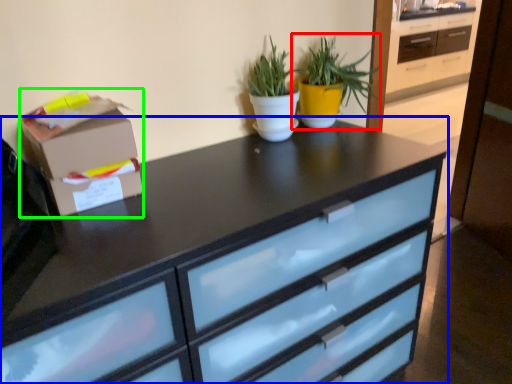
Question: Which object is the farthest from houseplant (highlighted by a red box)? Choose among these: chest of drawers (highlighted by a blue box) or cardboard box (highlighted by a green box).

Choices:
 (A) chest of drawers
 (B) cardboard box

Answer: (B)